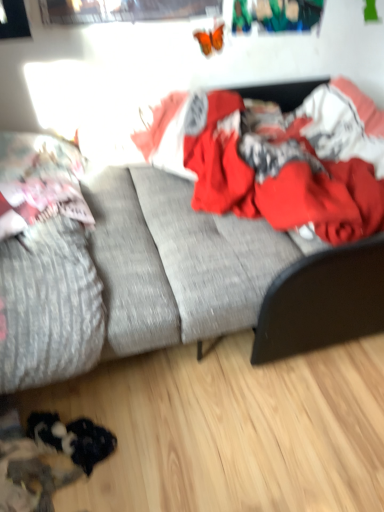
What do you see at coordinates (39, 181) in the screenshot?
I see `fluffy pink pillow at left` at bounding box center [39, 181].

What are the coordinates of `red cotton blanket at center` in the screenshot? It's located at (278, 158).

At what (x,y) coordinates should I click in order to perform the action: click on textured gray couch at center. Please return your answer as a coordinate pair (x, y). This screenshot has height=512, width=384. Looking at the image, I should click on (190, 267).

How much distance is there between textured gray couch at center and red cotton blanket at center?

They are 6.34 inches apart.

Is textured gray couch at center further to the viewer compared to red cotton blanket at center?

No, textured gray couch at center is in front of red cotton blanket at center.

Would you consider textured gray couch at center to be distant from red cotton blanket at center?

No, textured gray couch at center is not far away from red cotton blanket at center.

Is textured gray couch at center taller than red cotton blanket at center?

Yes.

Is textured gray mattress at left positioned with its back to fluffy pink pillow at left?

Yes, textured gray mattress at left is positioned with its back facing fluffy pink pillow at left.

In the image, is textured gray mattress at left on the left side or the right side of fluffy pink pillow at left?

textured gray mattress at left is to the right of fluffy pink pillow at left.

In terms of height, does textured gray mattress at left look taller or shorter compared to fluffy pink pillow at left?

Considering their sizes, textured gray mattress at left has more height than fluffy pink pillow at left.

In the scene shown: How different are the orientations of textured gray mattress at left and fluffy pink pillow at left in degrees?

1.63 degrees.

Is fluffy pink pillow at left oriented towards textured gray couch at center?

Yes, fluffy pink pillow at left is facing textured gray couch at center.

Is fluffy pink pillow at left thinner than textured gray couch at center?

Indeed, fluffy pink pillow at left has a lesser width compared to textured gray couch at center.

Is there a large distance between fluffy pink pillow at left and textured gray couch at center?

No, fluffy pink pillow at left is not far from textured gray couch at center.

How many degrees apart are the facing directions of textured gray mattress at left and red cotton blanket at center?

There is a 89.7-degree angle between the facing directions of textured gray mattress at left and red cotton blanket at center.

Would you say textured gray mattress at left is to the left or to the right of red cotton blanket at center in the picture?

Based on their positions, textured gray mattress at left is located to the left of red cotton blanket at center.

Would you consider textured gray mattress at left to be distant from red cotton blanket at center?

No, textured gray mattress at left is not far away from red cotton blanket at center.

Which is correct: textured gray mattress at left is inside red cotton blanket at center, or outside of it?

textured gray mattress at left is located beyond the bounds of red cotton blanket at center.

From a real-world perspective, between red cotton blanket at center and textured gray couch at center, who is vertically lower?

textured gray couch at center is physically lower.

Is red cotton blanket at center aimed at textured gray couch at center?

Yes, red cotton blanket at center faces towards textured gray couch at center.

Which object is positioned more to the left, red cotton blanket at center or textured gray couch at center?

textured gray couch at center.

Is point (373, 134) closer to camera compared to point (375, 187)?

No, (373, 134) is further to viewer.

From a real-world perspective, is textured gray mattress at left beneath textured gray couch at center?

No, from a real-world perspective, textured gray mattress at left is not beneath textured gray couch at center.

The image size is (384, 512). Find the location of `studio couch in front of the textured gray mattress at left`. studio couch in front of the textured gray mattress at left is located at coordinates (190, 267).

Considering the points (18, 268) and (379, 302), which point is behind, point (18, 268) or point (379, 302)?

The point (379, 302) is farther from the camera.

Is textured gray mattress at left not within textured gray couch at center?

No, textured gray mattress at left is inside textured gray couch at center's boundary.

Locate an element on the screen. This screenshot has height=512, width=384. clothing behind the textured gray mattress at left is located at coordinates (278, 158).

Is textured gray mattress at left surrounded by red cotton blanket at center?

No, textured gray mattress at left is located outside of red cotton blanket at center.

Is red cotton blanket at center smaller than textured gray mattress at left?

Actually, red cotton blanket at center might be larger than textured gray mattress at left.

Is red cotton blanket at center at the right side of textured gray mattress at left?

Yes.

The width and height of the screenshot is (384, 512). I want to click on clothing behind the textured gray couch at center, so click(278, 158).

What are the coordinates of `mattress below the fluffy pink pillow at left (from a real-world perspective)` in the screenshot? It's located at (48, 306).

Which object lies further to the anchor point textured gray couch at center, fluffy pink pillow at left or red cotton blanket at center?

fluffy pink pillow at left is positioned further to the anchor textured gray couch at center.

Looking at the image, which one is located further to red cotton blanket at center, textured gray couch at center or textured gray mattress at left?

textured gray mattress at left lies further to red cotton blanket at center than the other object.

When comparing their distances from red cotton blanket at center, does fluffy pink pillow at left or textured gray couch at center seem further?

fluffy pink pillow at left lies further to red cotton blanket at center than the other object.

Based on their spatial positions, is fluffy pink pillow at left or red cotton blanket at center further from textured gray mattress at left?

red cotton blanket at center lies further to textured gray mattress at left than the other object.

From the image, which object appears to be farther from textured gray mattress at left, red cotton blanket at center or fluffy pink pillow at left?

red cotton blanket at center is further to textured gray mattress at left.

Estimate the real-world distances between objects in this image. Which object is closer to fluffy pink pillow at left, textured gray mattress at left or red cotton blanket at center?

Based on the image, textured gray mattress at left appears to be nearer to fluffy pink pillow at left.

From the image, which object appears to be nearer to red cotton blanket at center, textured gray mattress at left or fluffy pink pillow at left?

Based on the image, fluffy pink pillow at left appears to be nearer to red cotton blanket at center.

When comparing their distances from fluffy pink pillow at left, does textured gray couch at center or textured gray mattress at left seem further?

Based on the image, textured gray couch at center appears to be further to fluffy pink pillow at left.

This screenshot has width=384, height=512. I want to click on mattress situated between fluffy pink pillow at left and red cotton blanket at center from left to right, so click(48, 306).

At what (x,y) coordinates should I click in order to perform the action: click on studio couch situated between textured gray mattress at left and red cotton blanket at center from left to right. Please return your answer as a coordinate pair (x, y). The height and width of the screenshot is (512, 384). Looking at the image, I should click on (190, 267).

The width and height of the screenshot is (384, 512). Identify the location of studio couch between fluffy pink pillow at left and red cotton blanket at center in the horizontal direction. point(190,267).

The height and width of the screenshot is (512, 384). In order to click on mattress between fluffy pink pillow at left and textured gray couch at center in the horizontal direction in this screenshot , I will do `click(48, 306)`.